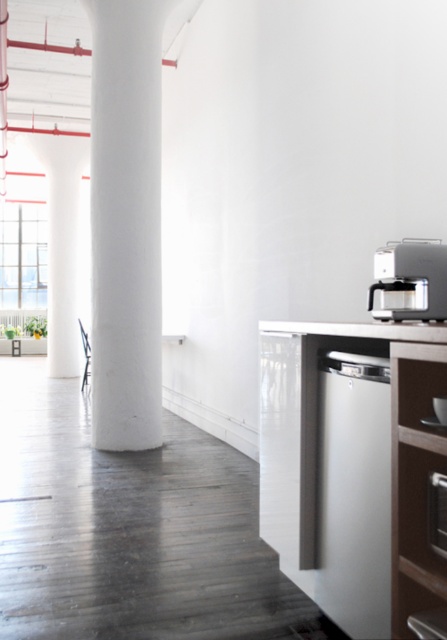
Does satin white dishwasher at lower right appear on the left side of white glossy pillar at center?

Incorrect, satin white dishwasher at lower right is not on the left side of white glossy pillar at center.

Between point (337, 387) and point (47, 236), which one is positioned in front?

Point (337, 387) is more forward.

Which is behind, point (338, 556) or point (62, 307)?

The point (62, 307) is behind.

Where is `satin white dishwasher at lower right`? The height and width of the screenshot is (640, 447). satin white dishwasher at lower right is located at coordinates (354, 493).

Which is below, white glossy dishwasher at lower right or white smooth column at center?

Positioned lower is white glossy dishwasher at lower right.

Find the location of a particular element. This screenshot has width=447, height=640. white glossy dishwasher at lower right is located at coordinates (355, 468).

Image resolution: width=447 pixels, height=640 pixels. I want to click on white glossy dishwasher at lower right, so click(x=355, y=468).

Does white glossy dishwasher at lower right have a greater height compared to satin white dishwasher at lower right?

Yes, white glossy dishwasher at lower right is taller than satin white dishwasher at lower right.

Who is positioned more to the right, white glossy dishwasher at lower right or satin white dishwasher at lower right?

From the viewer's perspective, white glossy dishwasher at lower right appears more on the right side.

Is point (281, 524) more distant than point (371, 602)?

That is True.

The height and width of the screenshot is (640, 447). Find the location of `white glossy dishwasher at lower right`. white glossy dishwasher at lower right is located at coordinates (355, 468).